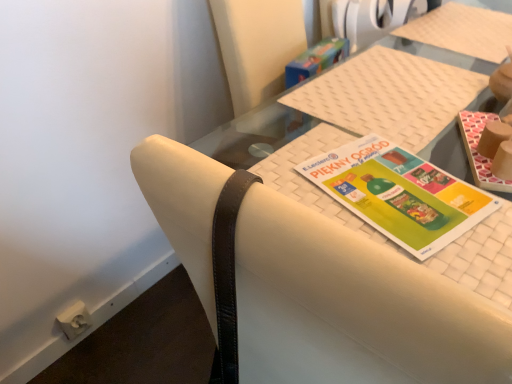
Where is `white woven placemat at center`? white woven placemat at center is located at coordinates (330, 119).

Locate an element on the screen. The width and height of the screenshot is (512, 384). matte brown book at upper right, positioned as the first book in right-to-left order is located at coordinates (478, 152).

Which object is thinner, white woven placemat at center or white leather chair at center?

Thinner between the two is white leather chair at center.

Is white woven placemat at center taller than white leather chair at center?

Yes, white woven placemat at center is taller than white leather chair at center.

How distant is white woven placemat at center from white leather chair at center?

The distance of white woven placemat at center from white leather chair at center is 8.20 inches.

Considering the positions of points (439, 280) and (477, 176), is point (439, 280) closer to camera compared to point (477, 176)?

Yes, it is.

Considering the relative sizes of white leather chair at center and matte brown book at upper right, positioned as the first book in right-to-left order, in the image provided, is white leather chair at center bigger than matte brown book at upper right, positioned as the first book in right-to-left order,?

Yes.

Is white leather chair at center to the right of matte brown book at upper right, placed as the second book when sorted from left to right, from the viewer's perspective?

No, white leather chair at center is not to the right of matte brown book at upper right, placed as the second book when sorted from left to right.

Would you say white leather chair at center is inside or outside matte brown book at upper right, positioned as the first book in right-to-left order?

white leather chair at center lies outside matte brown book at upper right, positioned as the first book in right-to-left order.

How many degrees apart are the facing directions of white leather chair at center and white woven placemat at center?

white leather chair at center and white woven placemat at center are facing 89.6 degrees away from each other.

Who is bigger, white leather chair at center or white woven placemat at center?

white woven placemat at center.

Is white leather chair at center taller than white woven placemat at center?

Incorrect, the height of white leather chair at center is not larger of that of white woven placemat at center.

Between point (336, 299) and point (236, 118), which one is positioned in front?

Positioned in front is point (336, 299).

From a real-world perspective, is white woven placemat at center physically below matte brown book at upper right, placed as the second book when sorted from left to right?

Correct, in the physical world, white woven placemat at center is lower than matte brown book at upper right, placed as the second book when sorted from left to right.

Considering the relative positions of white woven placemat at center and matte brown book at upper right, positioned as the first book in right-to-left order, in the image provided, is white woven placemat at center to the right of matte brown book at upper right, positioned as the first book in right-to-left order, from the viewer's perspective?

Yes.

Is white woven placemat at center shorter than matte brown book at upper right, placed as the second book when sorted from left to right?

Incorrect, the height of white woven placemat at center does not fall short of that of matte brown book at upper right, placed as the second book when sorted from left to right.

From the image's perspective, which is above, matte brown book at upper right, positioned as the first book in right-to-left order, or white woven placemat at center?

matte brown book at upper right, positioned as the first book in right-to-left order, appears higher in the image.

Does matte brown book at upper right, placed as the second book when sorted from left to right, have a larger size compared to white woven placemat at center?

Actually, matte brown book at upper right, placed as the second book when sorted from left to right, might be smaller than white woven placemat at center.

Image resolution: width=512 pixels, height=384 pixels. What are the coordinates of `book above the white woven placemat at center (from the image's perspective)` in the screenshot? It's located at (478, 152).

In order to click on book that is the 1st object located behind the white leather chair at center in this screenshot , I will do `click(399, 194)`.

Could you measure the distance between multicolored paper at center, positioned as the 2th book in right-to-left order, and white leather chair at center?

They are 12.47 inches apart.

From the image's perspective, is multicolored paper at center, positioned as the 2th book in right-to-left order, under white leather chair at center?

Actually, multicolored paper at center, positioned as the 2th book in right-to-left order, appears above white leather chair at center in the image.

Based on the photo, between multicolored paper at center, positioned as the 2th book in right-to-left order, and white leather chair at center, which one appears on the right side from the viewer's perspective?

From the viewer's perspective, multicolored paper at center, positioned as the 2th book in right-to-left order, appears more on the right side.

Between multicolored paper at center, positioned as the 2th book in right-to-left order, and white woven placemat at center, which one has larger width?

white woven placemat at center is wider.

Locate an element on the screen. The width and height of the screenshot is (512, 384). book that is the 2nd object to the left of the white woven placemat at center, starting at the anchor is located at coordinates (399, 194).

How many degrees apart are the facing directions of multicolored paper at center, positioned as the 2th book in right-to-left order, and white woven placemat at center?

The angle between the facing direction of multicolored paper at center, positioned as the 2th book in right-to-left order, and the facing direction of white woven placemat at center is 14.9 degrees.

Who is taller, multicolored paper at center, positioned as the 2th book in right-to-left order, or white woven placemat at center?

Standing taller between the two is white woven placemat at center.

Image resolution: width=512 pixels, height=384 pixels. Identify the location of tablecloth located behind the white leather chair at center. (330, 119).

The image size is (512, 384). Identify the location of the 2nd book above when counting from the white leather chair at center (from the image's perspective). (478, 152).

Looking at the image, which one is located closer to white leather chair at center, matte brown book at upper right, placed as the second book when sorted from left to right, or multicolored paper at center, positioned as the 1th book in left-to-right order?

multicolored paper at center, positioned as the 1th book in left-to-right order, lies closer to white leather chair at center than the other object.

From the image, which object appears to be farther from multicolored paper at center, positioned as the 1th book in left-to-right order, white woven placemat at center or matte brown book at upper right, placed as the second book when sorted from left to right?

The object further to multicolored paper at center, positioned as the 1th book in left-to-right order, is matte brown book at upper right, placed as the second book when sorted from left to right.

Estimate the real-world distances between objects in this image. Which object is further from matte brown book at upper right, placed as the second book when sorted from left to right, multicolored paper at center, positioned as the 2th book in right-to-left order, or white woven placemat at center?

white woven placemat at center is further to matte brown book at upper right, placed as the second book when sorted from left to right.

Estimate the real-world distances between objects in this image. Which object is further from white leather chair at center, matte brown book at upper right, placed as the second book when sorted from left to right, or white woven placemat at center?

Among the two, matte brown book at upper right, placed as the second book when sorted from left to right, is located further to white leather chair at center.

Which object lies nearer to the anchor point matte brown book at upper right, positioned as the first book in right-to-left order, white woven placemat at center or white leather chair at center?

Based on the image, white woven placemat at center appears to be nearer to matte brown book at upper right, positioned as the first book in right-to-left order.

When comparing their distances from white woven placemat at center, does white leather chair at center or matte brown book at upper right, positioned as the first book in right-to-left order, seem closer?

matte brown book at upper right, positioned as the first book in right-to-left order, is closer to white woven placemat at center.

Which object lies nearer to the anchor point matte brown book at upper right, placed as the second book when sorted from left to right, white leather chair at center or multicolored paper at center, positioned as the 2th book in right-to-left order?

multicolored paper at center, positioned as the 2th book in right-to-left order, is positioned closer to the anchor matte brown book at upper right, placed as the second book when sorted from left to right.

Looking at the image, which one is located closer to white leather chair at center, multicolored paper at center, positioned as the 2th book in right-to-left order, or matte brown book at upper right, positioned as the first book in right-to-left order?

multicolored paper at center, positioned as the 2th book in right-to-left order.

Where is `book between multicolored paper at center, positioned as the 1th book in left-to-right order, and white woven placemat at center, in the horizontal direction`? This screenshot has width=512, height=384. book between multicolored paper at center, positioned as the 1th book in left-to-right order, and white woven placemat at center, in the horizontal direction is located at coordinates (478, 152).

Where is `book between white leather chair at center and matte brown book at upper right, placed as the second book when sorted from left to right, from left to right`? book between white leather chair at center and matte brown book at upper right, placed as the second book when sorted from left to right, from left to right is located at coordinates (399, 194).